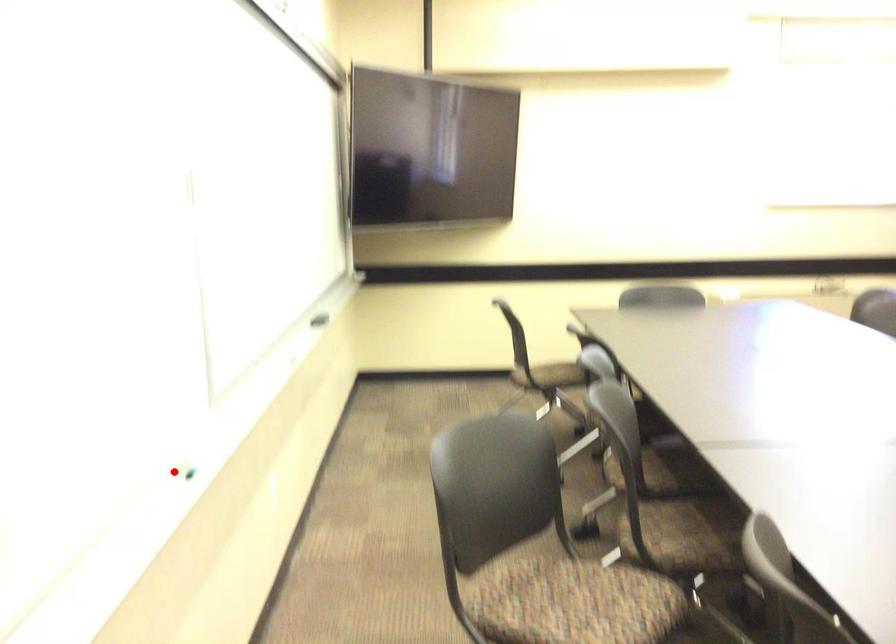
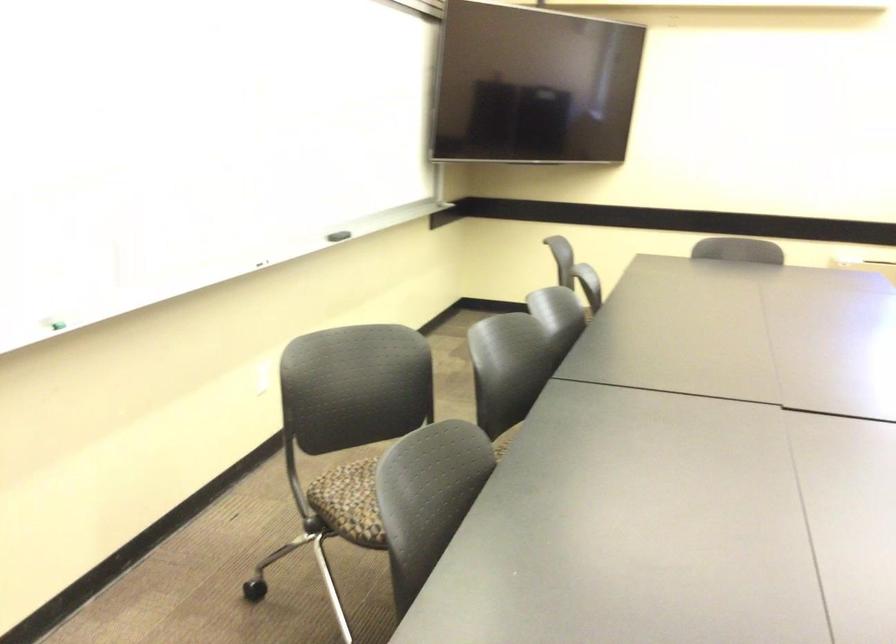
Question: A red point is marked in image1. In image2, is the corresponding 3D point closer to the camera or farther? Reply with the corresponding letter.

Choices:
 (A) The corresponding 3D point is closer.
 (B) The corresponding 3D point is farther.

Answer: (B)